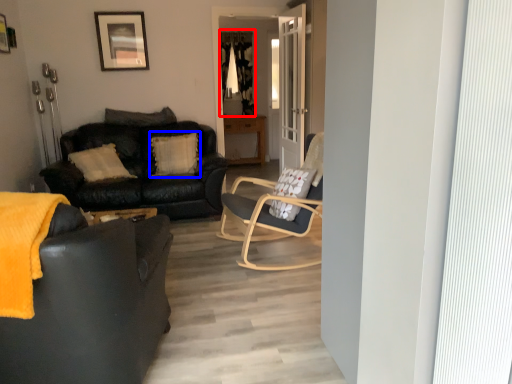
Question: Which object is further to the camera taking this photo, curtain (highlighted by a red box) or pillow (highlighted by a blue box)?

Choices:
 (A) curtain
 (B) pillow

Answer: (A)